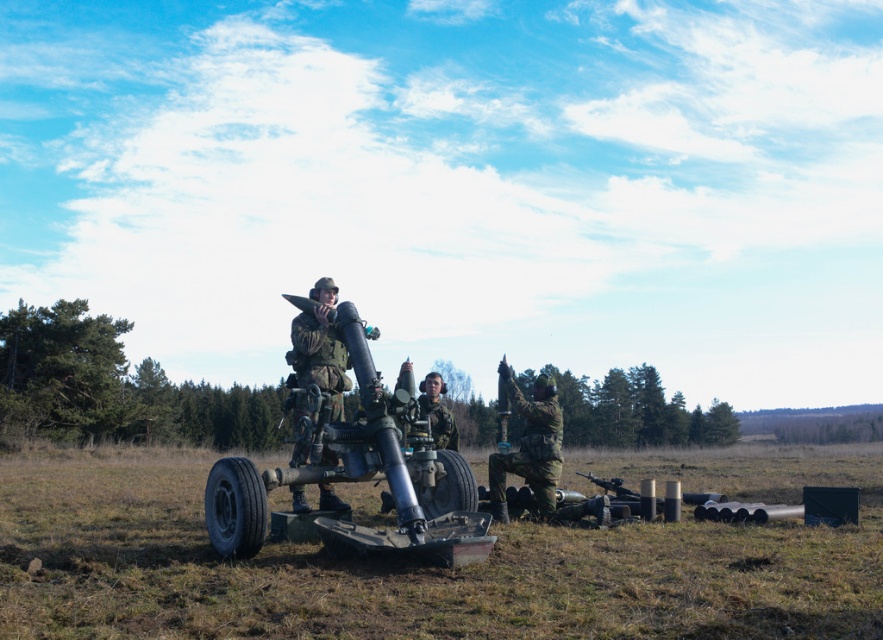
Question: Which object is positioned farthest from the matte green tank at center?

Choices:
 (A) camouflage fabric uniform at center
 (B) green matte helmet at center

Answer: (B)

Question: Which of these objects is positioned farthest from the matte green tank at center?

Choices:
 (A) green matte helmet at center
 (B) matte black rifle at center
 (C) camouflage fabric uniform at center
 (D) camouflage fabric helmet at center

Answer: (B)

Question: Estimate the real-world distances between objects in this image. Which object is closer to the camouflage fabric helmet at center?

Choices:
 (A) green matte helmet at center
 (B) camouflage fabric uniform at center

Answer: (A)

Question: Observing the image, what is the correct spatial positioning of camouflage fabric uniform at center in reference to green matte helmet at center?

Choices:
 (A) above
 (B) below

Answer: (A)

Question: Is green matte helmet at center to the left of matte black rifle at center from the viewer's perspective?

Choices:
 (A) no
 (B) yes

Answer: (B)

Question: Is camouflage fabric uniform at center positioned at the back of green matte helmet at center?

Choices:
 (A) yes
 (B) no

Answer: (B)